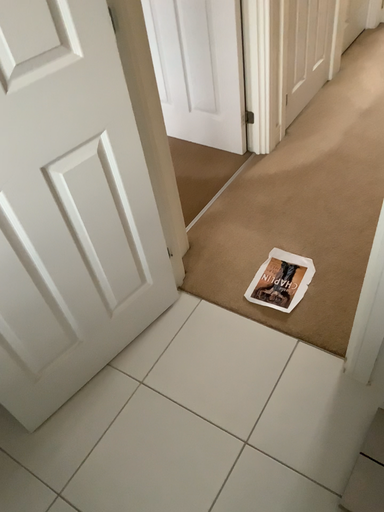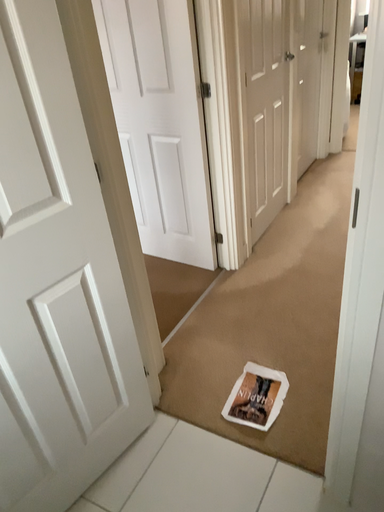
Question: How did the camera likely rotate when shooting the video?

Choices:
 (A) rotated downward
 (B) rotated upward

Answer: (B)